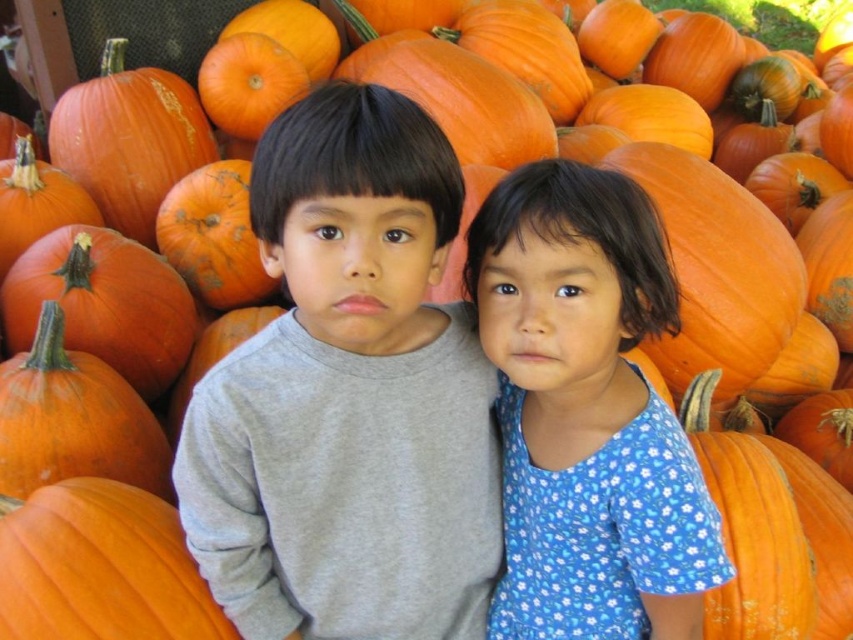
Which is more to the right, gray cotton shirt at center or blue floral dress at center?

Positioned to the right is blue floral dress at center.

Which is behind, point (335, 228) or point (569, 176)?

The point (569, 176) is more distant.

Image resolution: width=853 pixels, height=640 pixels. In order to click on gray cotton shirt at center in this screenshot , I will do `click(347, 396)`.

The height and width of the screenshot is (640, 853). I want to click on gray cotton shirt at center, so click(x=347, y=396).